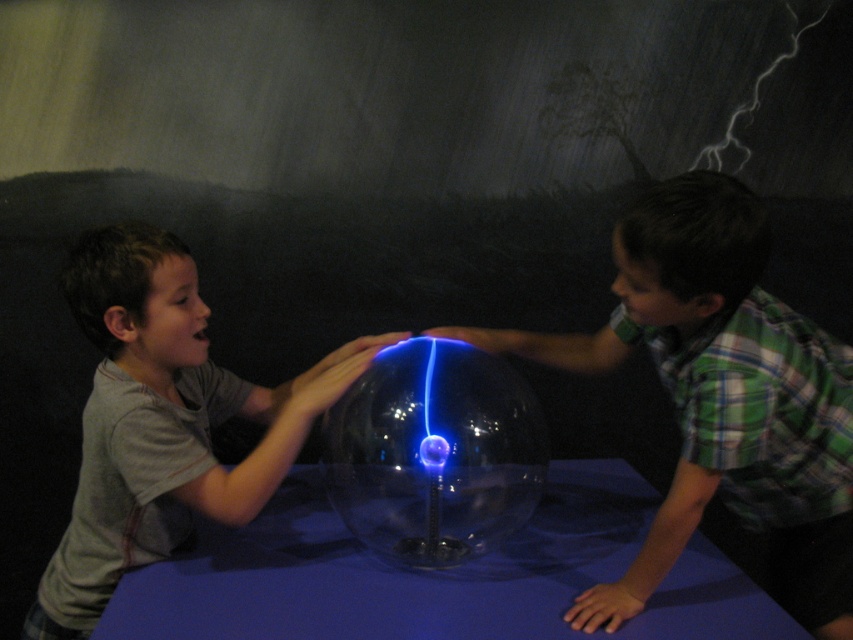
Question: Which point is farther to the camera?

Choices:
 (A) (189, 339)
 (B) (421, 536)
 (C) (792, 589)
 (D) (444, 605)

Answer: (C)

Question: Which of the following is the closest to the observer?

Choices:
 (A) (363, 456)
 (B) (589, 557)
 (C) (122, 358)

Answer: (C)

Question: Can you confirm if green plaid shirt at right is positioned above matte gray shirt at left?

Choices:
 (A) yes
 (B) no

Answer: (A)

Question: Is blue fabric table at center positioned behind transparent glass sphere at center?

Choices:
 (A) no
 (B) yes

Answer: (A)

Question: Which point is closer to the camera?

Choices:
 (A) (218, 404)
 (B) (659, 253)
 (C) (445, 548)

Answer: (B)

Question: Can you confirm if blue fabric table at center is thinner than matte gray shirt at left?

Choices:
 (A) yes
 (B) no

Answer: (B)